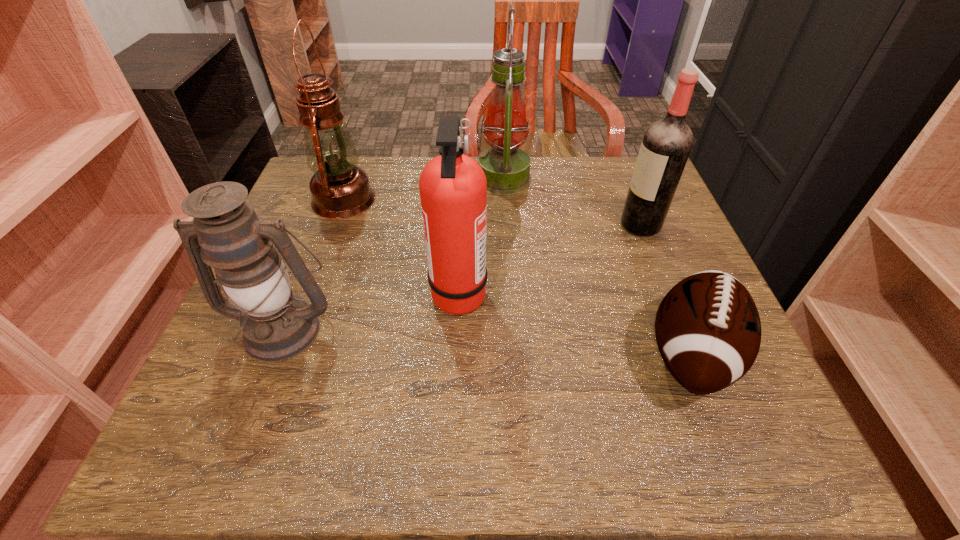
This screenshot has height=540, width=960. I want to click on vacant area situated on the right of the shortest oil lamp, so click(x=443, y=328).

Identify the location of vacant point located on the left of the shortest object. (419, 355).

You are a GUI agent. You are given a task and a screenshot of the screen. Output one action in this format:
    pyautogui.click(x=<x>, y=<y>)
    Task: Click on the object that is at the near edge
    This screenshot has height=540, width=960.
    Given the screenshot: What is the action you would take?
    pyautogui.click(x=708, y=330)

I want to click on liquor that is at the right edge, so click(666, 145).

Locate an element on the screen. The image size is (960, 540). football (American) present at the right edge is located at coordinates (708, 330).

You are a GUI agent. You are given a task and a screenshot of the screen. Output one action in this format:
    pyautogui.click(x=<x>, y=<y>)
    Task: Click on the object at the far left corner
    The width and height of the screenshot is (960, 540).
    Given the screenshot: What is the action you would take?
    pyautogui.click(x=340, y=189)

Identify the location of object located in the near right corner section of the desktop. (708, 330).

At what (x,y) coordinates should I click in order to perform the action: click on vacant space at the far edge of the desktop. Please return your answer as a coordinate pair (x, y). This screenshot has height=540, width=960. Looking at the image, I should click on (552, 195).

Find the location of a particular element. The image size is (960, 540). vacant region at the near edge of the desktop is located at coordinates (592, 424).

Find the location of `vacant space at the left edge of the desktop`. vacant space at the left edge of the desktop is located at coordinates (302, 377).